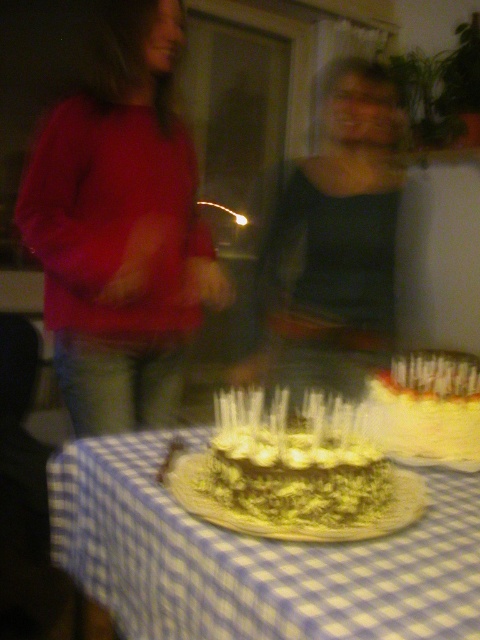
Does matte red sweater at left appear under dark gray sweater at center?

Correct, matte red sweater at left is located below dark gray sweater at center.

Who is more distant from viewer, (93, 216) or (351, 74)?

Point (351, 74)

Between point (128, 371) and point (373, 220), which one is positioned in front?

Point (128, 371) is more forward.

At what (x,y) coordinates should I click in order to perform the action: click on matte red sweater at left. Please return your answer as a coordinate pair (x, y). This screenshot has width=480, height=640. Looking at the image, I should click on (120, 228).

Is matte red sweater at left taller than blue checkered tablecloth at center?

Indeed, matte red sweater at left has a greater height compared to blue checkered tablecloth at center.

At what (x,y) coordinates should I click in order to perform the action: click on matte red sweater at left. Please return your answer as a coordinate pair (x, y). Image resolution: width=480 pixels, height=640 pixels. Looking at the image, I should click on (120, 228).

At what (x,y) coordinates should I click in order to perform the action: click on matte red sweater at left. Please return your answer as a coordinate pair (x, y). Looking at the image, I should click on (120, 228).

Can you confirm if blue checkered tablecloth at center is smaller than chocolate frosted cake at center?

Actually, blue checkered tablecloth at center might be larger than chocolate frosted cake at center.

Who is more distant from viewer, (240, 554) or (237, 456)?

The point (237, 456) is more distant.

This screenshot has height=640, width=480. In order to click on blue checkered tablecloth at center in this screenshot , I will do `click(254, 560)`.